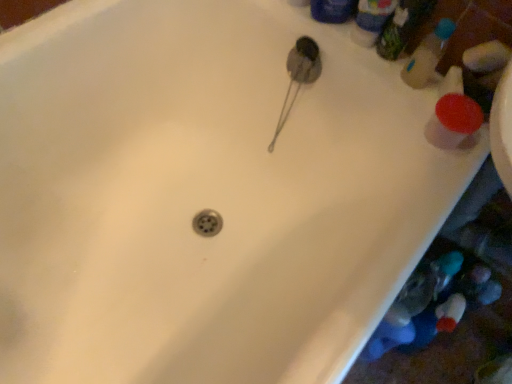
What is the approximate width of translucent plastic bottle at upper right?

translucent plastic bottle at upper right is 3.41 centimeters in width.

This screenshot has width=512, height=384. What do you see at coordinates (426, 55) in the screenshot? I see `translucent plastic bottle at upper right` at bounding box center [426, 55].

Where is `translucent plastic bottle at upper right`? translucent plastic bottle at upper right is located at coordinates (426, 55).

Where is `translucent plastic bottle at upper right`? This screenshot has width=512, height=384. translucent plastic bottle at upper right is located at coordinates (426, 55).